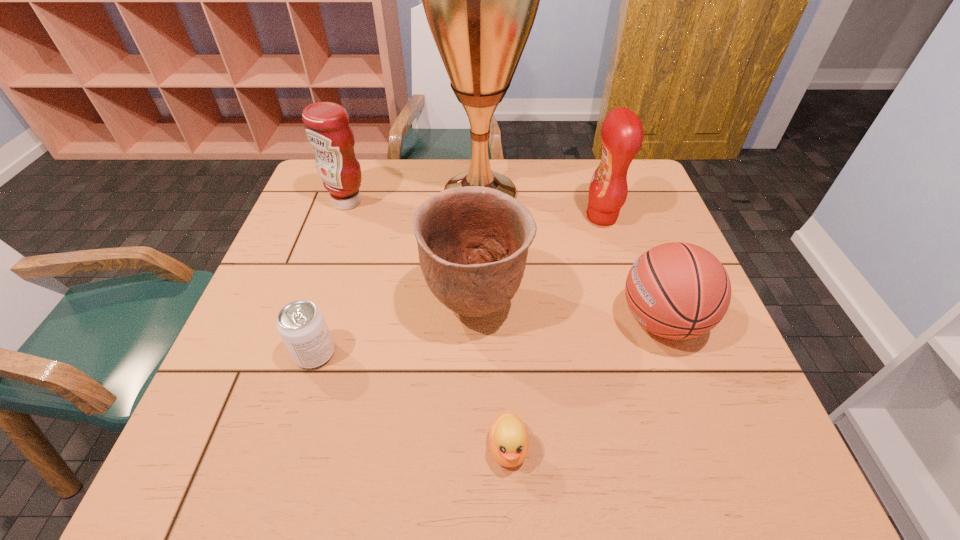
Where is `condiment that is positioned at the left edge`? The image size is (960, 540). condiment that is positioned at the left edge is located at coordinates (327, 127).

Locate an element on the screen. Image resolution: width=960 pixels, height=540 pixels. soda can present at the left edge is located at coordinates (301, 324).

Find the location of a particular element. Image resolution: width=960 pixels, height=540 pixels. condiment that is at the right edge is located at coordinates (622, 133).

The height and width of the screenshot is (540, 960). I want to click on basketball that is at the right edge, so click(677, 290).

Identify the location of object present at the far left corner. This screenshot has height=540, width=960. (327, 127).

Find the location of a particular element. object at the far right corner is located at coordinates (622, 133).

In the image, there is a desktop. Where is `vacant space at the far edge`? The height and width of the screenshot is (540, 960). vacant space at the far edge is located at coordinates (517, 183).

Where is `vacant region at the near edge of the desktop`? The height and width of the screenshot is (540, 960). vacant region at the near edge of the desktop is located at coordinates (618, 439).

Image resolution: width=960 pixels, height=540 pixels. Find the location of `vacant space at the left edge of the desktop`. vacant space at the left edge of the desktop is located at coordinates (193, 432).

Image resolution: width=960 pixels, height=540 pixels. Find the location of `vacant space at the right edge of the desktop`. vacant space at the right edge of the desktop is located at coordinates (696, 413).